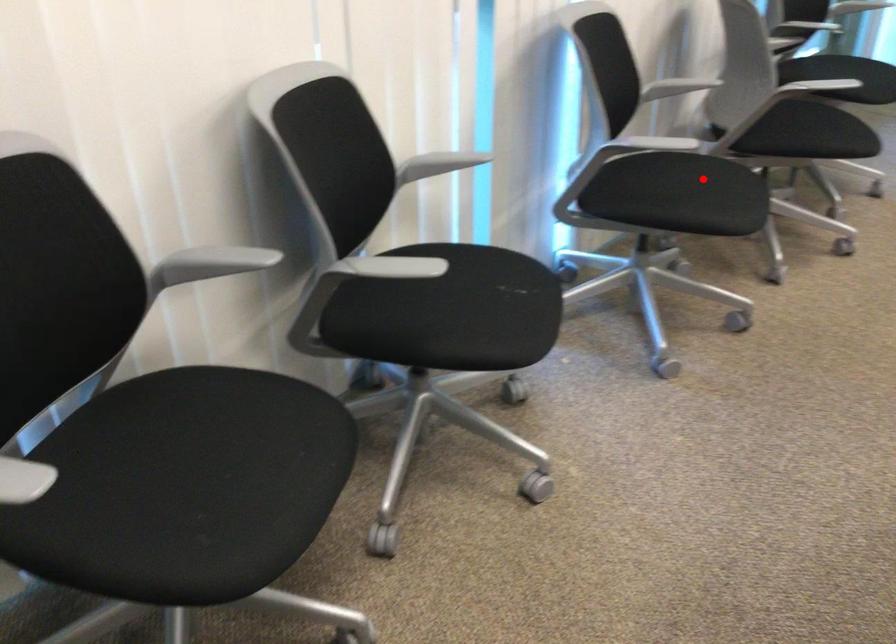
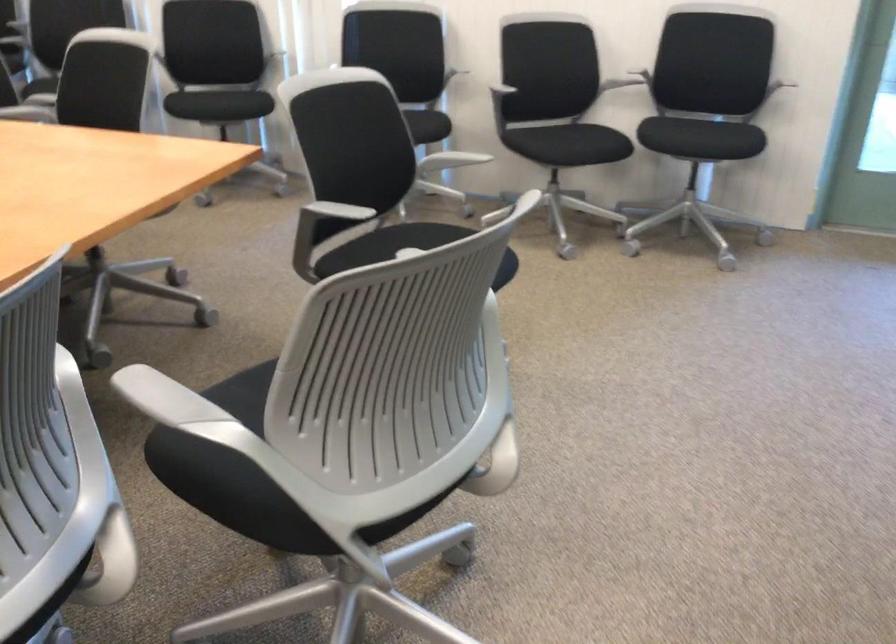
Question: A red point is marked in image1. In image2, is the corresponding 3D point closer to the camera or farther? Reply with the corresponding letter.

Choices:
 (A) The corresponding 3D point is closer.
 (B) The corresponding 3D point is farther.

Answer: (B)